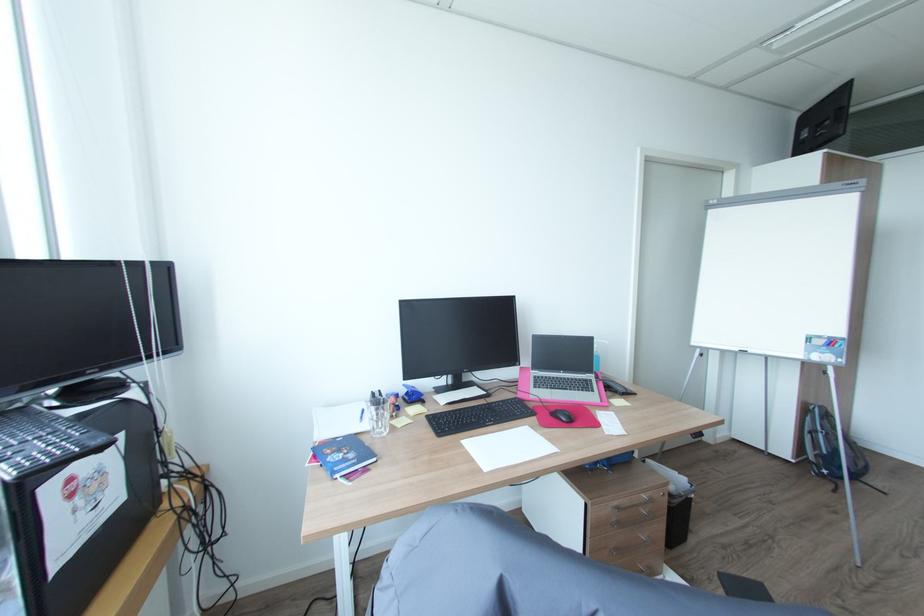
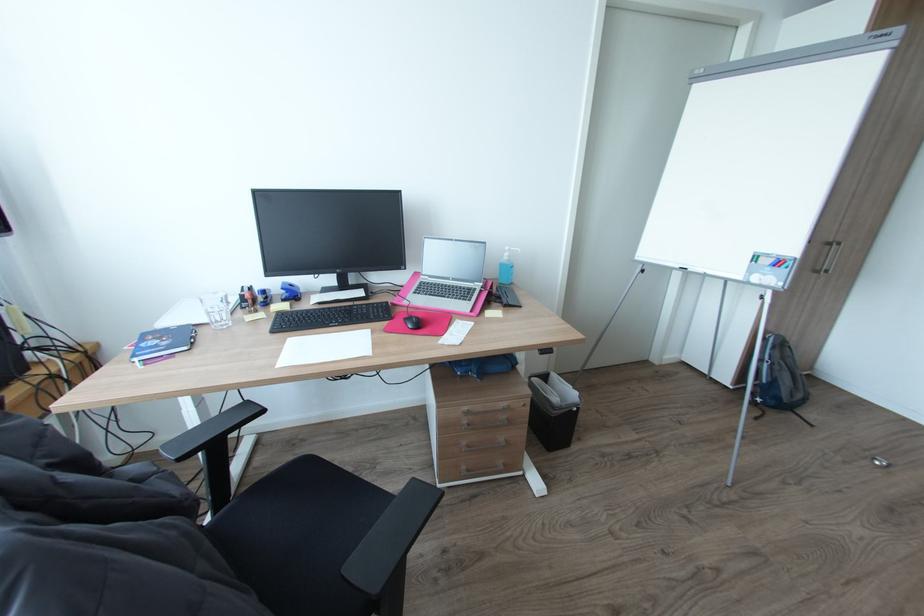
Question: Based on the continuous images, in which direction is the camera rotating? Reply with the corresponding letter.

Choices:
 (A) Left
 (B) Right
 (C) Up
 (D) Down

Answer: (D)